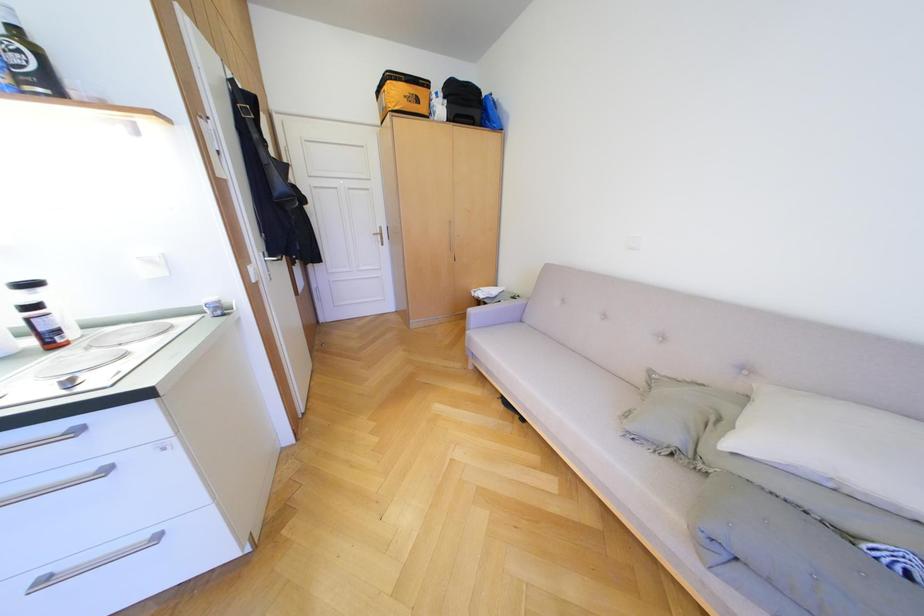
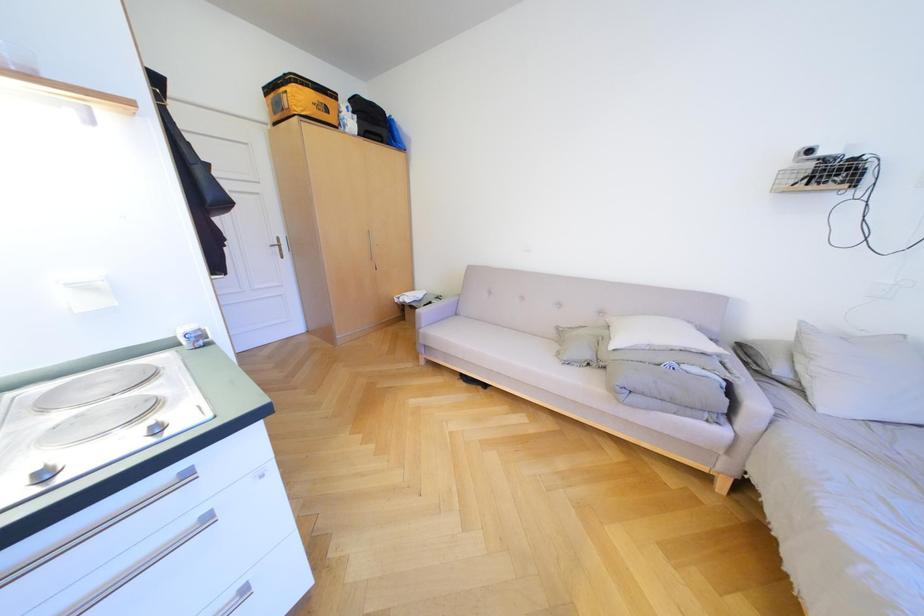
Question: What movement of the cameraman would produce the second image?

Choices:
 (A) Left
 (B) Right
 (C) Forward
 (D) Backward

Answer: (A)